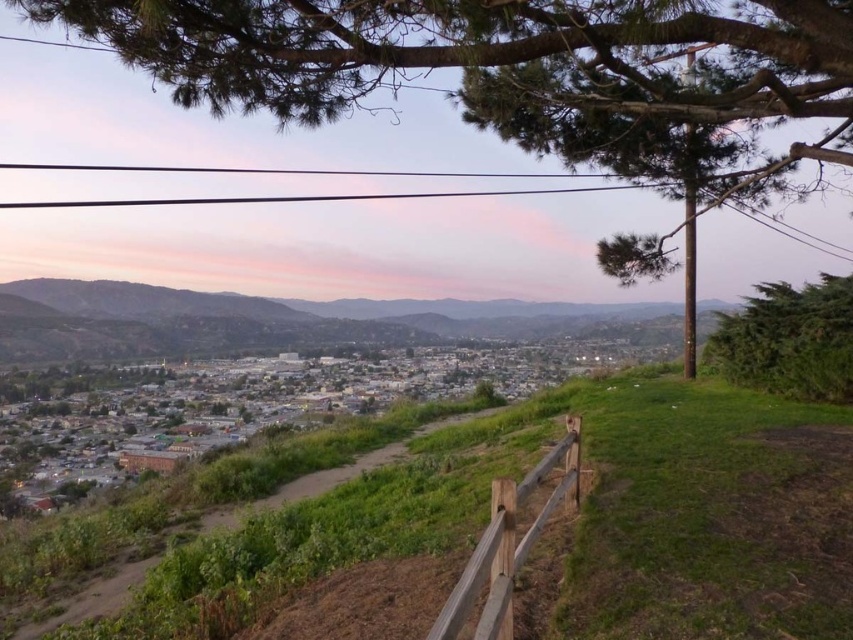
Question: Based on their relative distances, which object is nearer to the brown wooden fence at lower right?

Choices:
 (A) green leafy tree at upper center
 (B) green grassy hillside at center
 (C) green leafy bush at right

Answer: (A)

Question: Does green leafy bush at right lie behind brown wooden fence at lower right?

Choices:
 (A) no
 (B) yes

Answer: (B)

Question: Which is nearer to the green grassy hillside at center?

Choices:
 (A) green leafy tree at upper center
 (B) brown wooden fence at lower right

Answer: (A)

Question: Can you confirm if green leafy bush at right is positioned above brown wooden fence at lower right?

Choices:
 (A) no
 (B) yes

Answer: (B)

Question: Which of these objects is positioned closest to the green leafy bush at right?

Choices:
 (A) green leafy tree at upper center
 (B) green grassy hillside at center

Answer: (A)

Question: Is green grassy hillside at center above brown wooden fence at lower right?

Choices:
 (A) no
 (B) yes

Answer: (B)